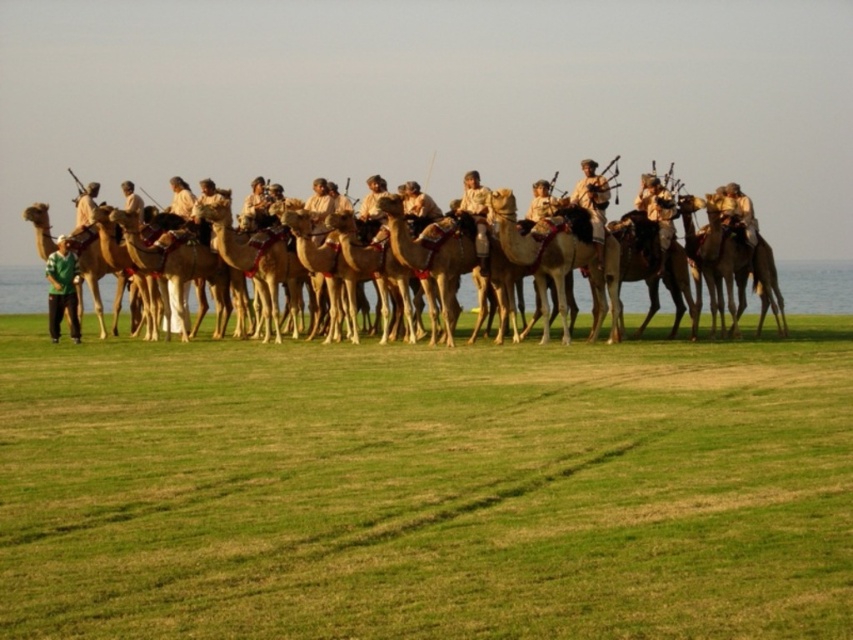
You are standing on the grassy field and see the green grass at lower center and the light brown leather jacket at center. Which object is closer to you?

The green grass at lower center is closer to you because it is positioned below the light brown leather jacket at center, indicating it is nearer in the scene.